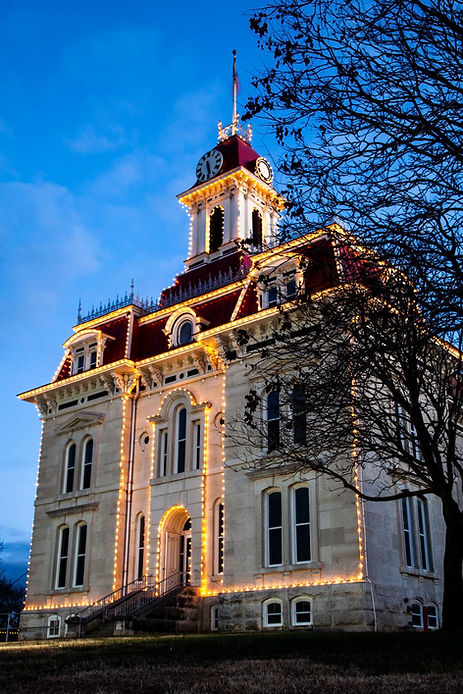
Image resolution: width=463 pixels, height=694 pixels. I want to click on door, so click(181, 559).